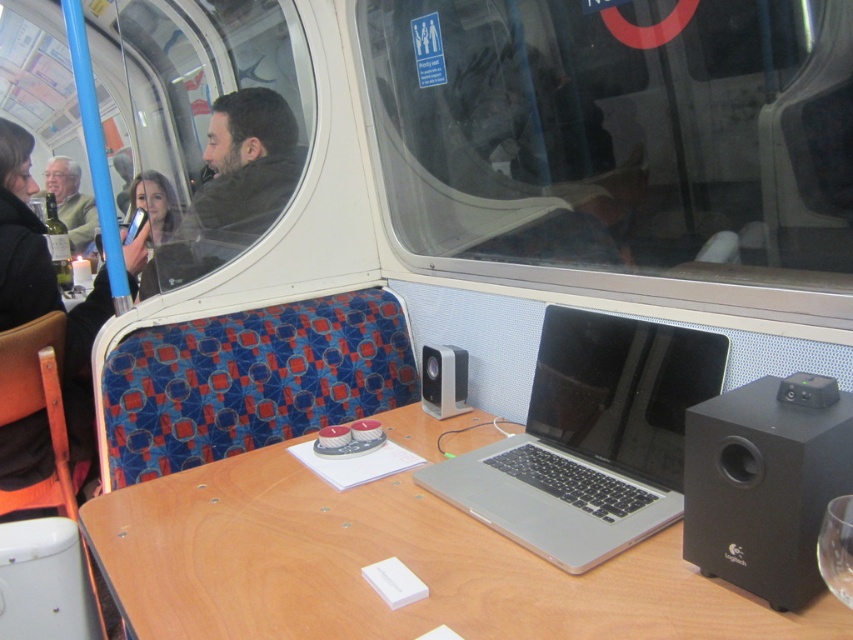
Question: Is silver metallic laptop at center thinner than satin silver speaker at upper center?

Choices:
 (A) no
 (B) yes

Answer: (A)

Question: Which point is closer to the camera?

Choices:
 (A) black plastic speaker at lower right
 (B) transparent glass at lower right

Answer: (B)

Question: Is satin silver speaker at upper center smaller than matte black jacket at upper left?

Choices:
 (A) no
 (B) yes

Answer: (B)

Question: Which object is positioned farthest from the satin silver speaker at upper center?

Choices:
 (A) transparent glass window at center
 (B) silver metallic laptop at center
 (C) black plastic speaker at lower right

Answer: (C)

Question: Which object appears farthest from the camera in this image?

Choices:
 (A) transparent glass window at center
 (B) wooden table at center
 (C) transparent glass at lower right

Answer: (A)

Question: Is transparent glass window at center wider than transparent glass at lower right?

Choices:
 (A) yes
 (B) no

Answer: (A)